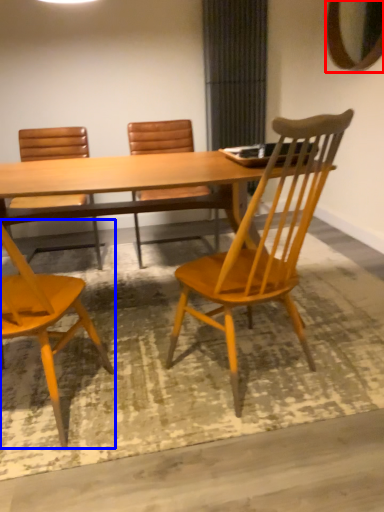
Question: Which point is closer to the camera, mirror (highlighted by a red box) or chair (highlighted by a blue box)?

Choices:
 (A) mirror
 (B) chair

Answer: (B)